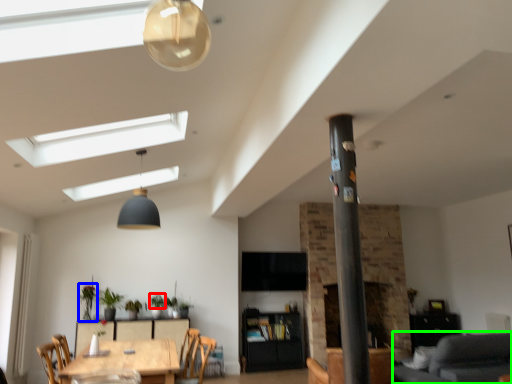
Question: Based on their relative distances, which object is nearer to plant (highlighted by a red box)? Choose from plant (highlighted by a blue box) and couch (highlighted by a green box).

Choices:
 (A) plant
 (B) couch

Answer: (A)